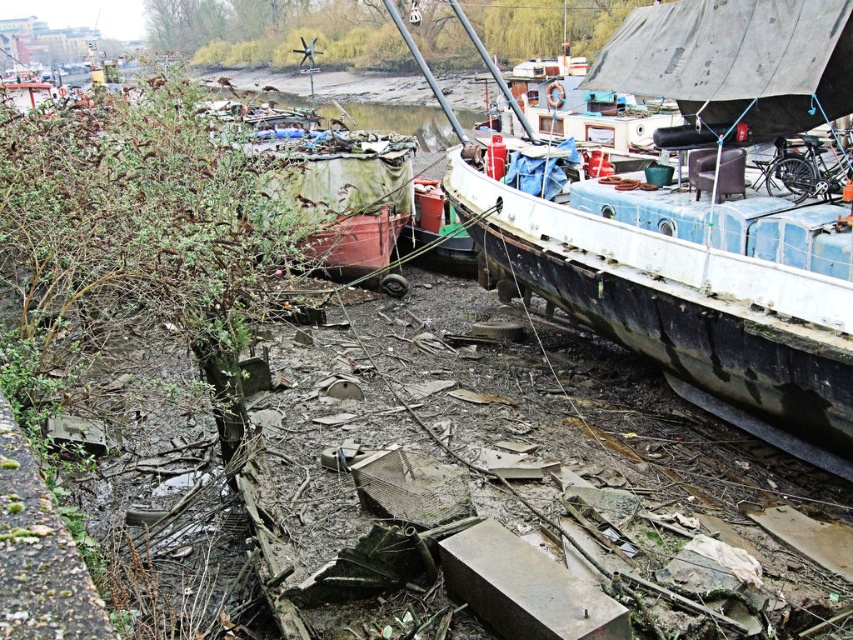
Question: Among these points, which one is farthest from the camera?

Choices:
 (A) (318, 182)
 (B) (601, 204)

Answer: (A)

Question: Does blue painted wood boat at right have a lesser width compared to rusty metal boat at center?

Choices:
 (A) no
 (B) yes

Answer: (B)

Question: Considering the relative positions of blue painted wood boat at right and rusty metal boat at center in the image provided, where is blue painted wood boat at right located with respect to rusty metal boat at center?

Choices:
 (A) below
 (B) above

Answer: (A)

Question: From the image, what is the correct spatial relationship of blue painted wood boat at right in relation to rusty metal boat at center?

Choices:
 (A) above
 (B) below

Answer: (B)

Question: Which of the following is the farthest from the observer?

Choices:
 (A) (354, 134)
 (B) (650, 72)

Answer: (A)